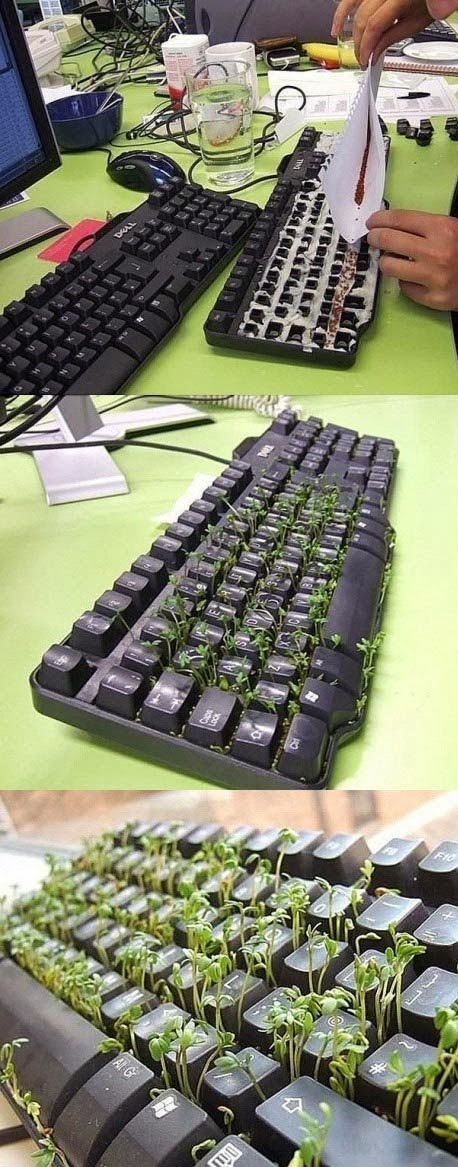
Identify the location of mouse. (145, 163).